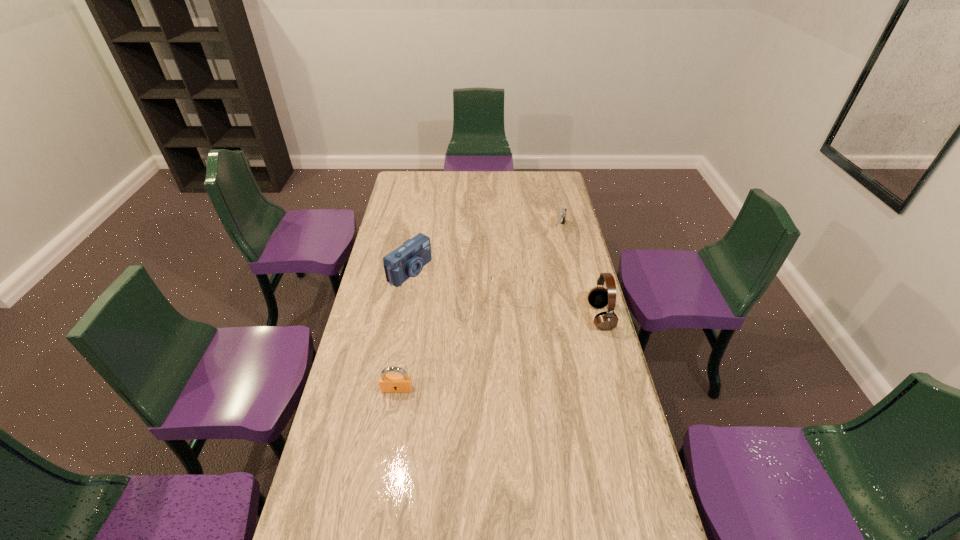
You are a GUI agent. You are given a task and a screenshot of the screen. Output one action in this format:
    pyautogui.click(x=<x>, y=<y>)
    Task: Click on the vacant space on the desktop that is between the nearest object and the headset and is positioned on the front-facing side of the third object from left to right
    This screenshot has width=960, height=540.
    Given the screenshot: What is the action you would take?
    pyautogui.click(x=508, y=349)

What are the coordinates of `vacant space on the desktop that is between the nearest object and the headset and is positioned on the lens of the camera` in the screenshot? It's located at (534, 340).

Locate an element on the screen. Image resolution: width=960 pixels, height=540 pixels. vacant space on the desktop that is between the nearest object and the tallest object and is positioned at the muzzle of the gun is located at coordinates (517, 346).